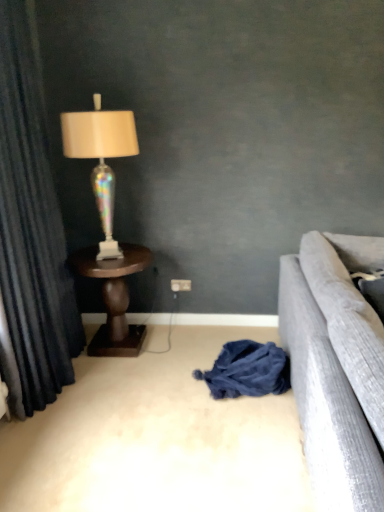
Question: Is brown wooden table at left not near dark blue velvet curtain at left?

Choices:
 (A) no
 (B) yes

Answer: (A)

Question: Is brown wooden table at left facing towards dark blue velvet curtain at left?

Choices:
 (A) yes
 (B) no

Answer: (B)

Question: Is brown wooden table at left closer to the viewer compared to dark blue velvet curtain at left?

Choices:
 (A) no
 (B) yes

Answer: (A)

Question: From the image's perspective, does brown wooden table at left appear higher than dark blue velvet curtain at left?

Choices:
 (A) no
 (B) yes

Answer: (A)

Question: Is brown wooden table at left located outside dark blue velvet curtain at left?

Choices:
 (A) yes
 (B) no

Answer: (A)

Question: Is white plastic power outlet at center wider or thinner than iridescent glass lamp at left?

Choices:
 (A) thin
 (B) wide

Answer: (A)

Question: Would you say white plastic power outlet at center is to the left or to the right of iridescent glass lamp at left in the picture?

Choices:
 (A) right
 (B) left

Answer: (A)

Question: Based on their sizes in the image, would you say white plastic power outlet at center is bigger or smaller than iridescent glass lamp at left?

Choices:
 (A) big
 (B) small

Answer: (B)

Question: In the image, is white plastic power outlet at center positioned in front of or behind iridescent glass lamp at left?

Choices:
 (A) front
 (B) behind

Answer: (B)

Question: Would you say dark blue velvet curtain at left is inside or outside dark blue fabric at center?

Choices:
 (A) inside
 (B) outside

Answer: (B)

Question: From a real-world perspective, relative to dark blue fabric at center, is dark blue velvet curtain at left vertically above or below?

Choices:
 (A) above
 (B) below

Answer: (A)

Question: In terms of height, does dark blue velvet curtain at left look taller or shorter compared to dark blue fabric at center?

Choices:
 (A) tall
 (B) short

Answer: (A)

Question: In terms of width, does dark blue velvet curtain at left look wider or thinner when compared to dark blue fabric at center?

Choices:
 (A) wide
 (B) thin

Answer: (B)

Question: Considering the positions of point (170, 284) and point (119, 300), is point (170, 284) closer or farther from the camera than point (119, 300)?

Choices:
 (A) farther
 (B) closer

Answer: (A)

Question: Looking at their shapes, would you say white plastic power outlet at center is wider or thinner than brown wooden table at left?

Choices:
 (A) thin
 (B) wide

Answer: (A)